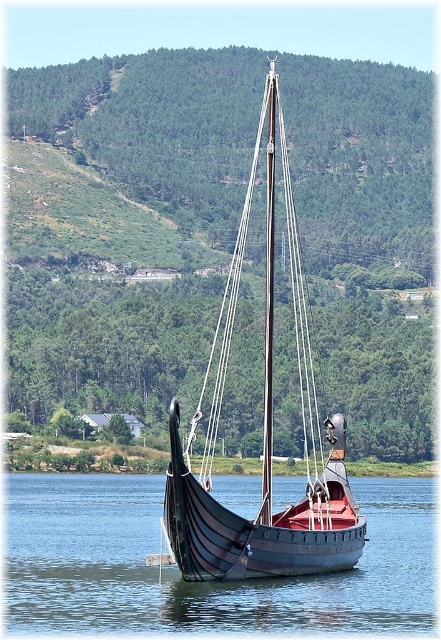
Is point (168, 179) positioned after point (126, 577)?

Yes, it is.

Which is more to the left, green forested hillside at upper center or smooth blue water at center?

green forested hillside at upper center

Between point (100, 150) and point (333, 632), which one is positioned in front?

Point (333, 632) is more forward.

I want to click on green forested hillside at upper center, so pos(153,124).

Who is taller, smooth blue water at center or black wood sailboat at center?

With more height is black wood sailboat at center.

Which is in front, point (387, 552) or point (189, 499)?

Positioned in front is point (189, 499).

This screenshot has width=441, height=640. What are the coordinates of `smooth blue water at center` in the screenshot? It's located at (201, 582).

Between point (351, 118) and point (245, 572), which one is positioned behind?

The point (351, 118) is more distant.

Identify the location of green forested hillside at upper center. This screenshot has height=640, width=441. (153, 124).